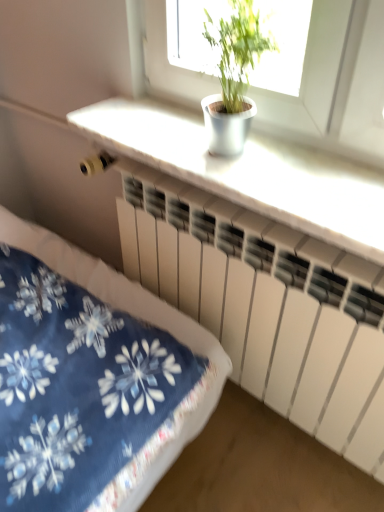
Question: Is white matte counter top at upper center facing towards white matte radiator at center?

Choices:
 (A) yes
 (B) no

Answer: (B)

Question: Are white matte counter top at upper center and white matte radiator at center located far from each other?

Choices:
 (A) yes
 (B) no

Answer: (B)

Question: Can you confirm if white matte counter top at upper center is wider than white matte radiator at center?

Choices:
 (A) yes
 (B) no

Answer: (A)

Question: Is white matte counter top at upper center shorter than white matte radiator at center?

Choices:
 (A) no
 (B) yes

Answer: (B)

Question: Is white matte counter top at upper center at the left side of white matte radiator at center?

Choices:
 (A) no
 (B) yes

Answer: (B)

Question: Is green leafy plant at upper center in front of or behind white matte radiator at center in the image?

Choices:
 (A) front
 (B) behind

Answer: (A)

Question: Is green leafy plant at upper center taller or shorter than white matte radiator at center?

Choices:
 (A) tall
 (B) short

Answer: (B)

Question: Is green leafy plant at upper center to the left or to the right of white matte radiator at center in the image?

Choices:
 (A) left
 (B) right

Answer: (A)

Question: From a real-world perspective, is green leafy plant at upper center physically located above or below white matte radiator at center?

Choices:
 (A) above
 (B) below

Answer: (A)

Question: Would you say green leafy plant at upper center is to the left or to the right of white matte counter top at upper center in the picture?

Choices:
 (A) left
 (B) right

Answer: (A)

Question: From the image's perspective, relative to white matte counter top at upper center, is green leafy plant at upper center above or below?

Choices:
 (A) below
 (B) above

Answer: (B)

Question: Considering the positions of green leafy plant at upper center and white matte counter top at upper center in the image, is green leafy plant at upper center taller or shorter than white matte counter top at upper center?

Choices:
 (A) short
 (B) tall

Answer: (B)

Question: Choose the correct answer: Is green leafy plant at upper center inside white matte counter top at upper center or outside it?

Choices:
 (A) outside
 (B) inside

Answer: (A)

Question: From the image's perspective, is white matte counter top at upper center located above or below green leafy plant at upper center?

Choices:
 (A) above
 (B) below

Answer: (B)

Question: In terms of width, does white matte counter top at upper center look wider or thinner when compared to green leafy plant at upper center?

Choices:
 (A) wide
 (B) thin

Answer: (A)